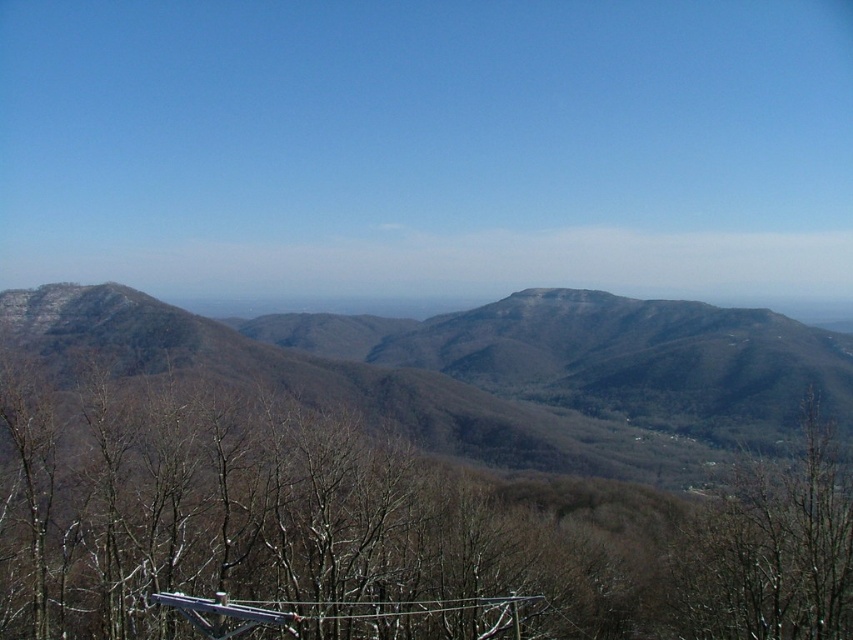
Question: Is brown textured mountain range at center smaller than brown leafless tree at lower right?

Choices:
 (A) yes
 (B) no

Answer: (B)

Question: Which point appears farthest from the camera in this image?

Choices:
 (A) pos(721,534)
 (B) pos(753,371)

Answer: (B)

Question: Which of the following is the farthest from the observer?

Choices:
 (A) (x=727, y=500)
 (B) (x=509, y=371)

Answer: (B)

Question: Does brown textured mountain range at center have a smaller size compared to brown leafless tree at lower right?

Choices:
 (A) yes
 (B) no

Answer: (B)

Question: Which object appears farthest from the camera in this image?

Choices:
 (A) brown leafless tree at lower right
 (B) brown textured mountain range at center

Answer: (B)

Question: Where is brown textured mountain range at center located in relation to brown leafless tree at lower right in the image?

Choices:
 (A) below
 (B) above

Answer: (B)